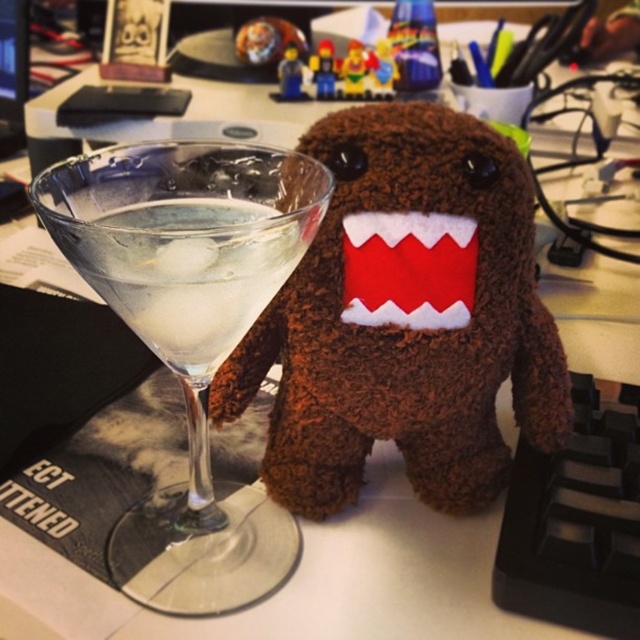
Question: Observing the image, what is the correct spatial positioning of black plastic keyboard at lower right in reference to smooth plastic minifigure at center?

Choices:
 (A) left
 (B) right

Answer: (B)

Question: Can you confirm if plastic minifigures at upper center is positioned to the right of smooth plastic minifigure at center?

Choices:
 (A) yes
 (B) no

Answer: (A)

Question: Can you confirm if smooth plastic toy at center is positioned below matte plastic lego minifigure at center?

Choices:
 (A) yes
 (B) no

Answer: (A)

Question: Which of these objects is positioned farthest from the matte plastic lego minifigure at center?

Choices:
 (A) transparent glass martini at left
 (B) clear glass ice at left
 (C) smooth plastic minifigure at center
 (D) plastic minifigures at upper center

Answer: (A)

Question: Among these objects, which one is nearest to the camera?

Choices:
 (A) matte plastic lego minifigure at center
 (B) smooth plastic minifigure at center

Answer: (B)

Question: Which object is the closest to the transparent glass martini at left?

Choices:
 (A) clear glass ice at left
 (B) plastic minifigures at upper center
 (C) smooth plastic minifigure at center

Answer: (A)